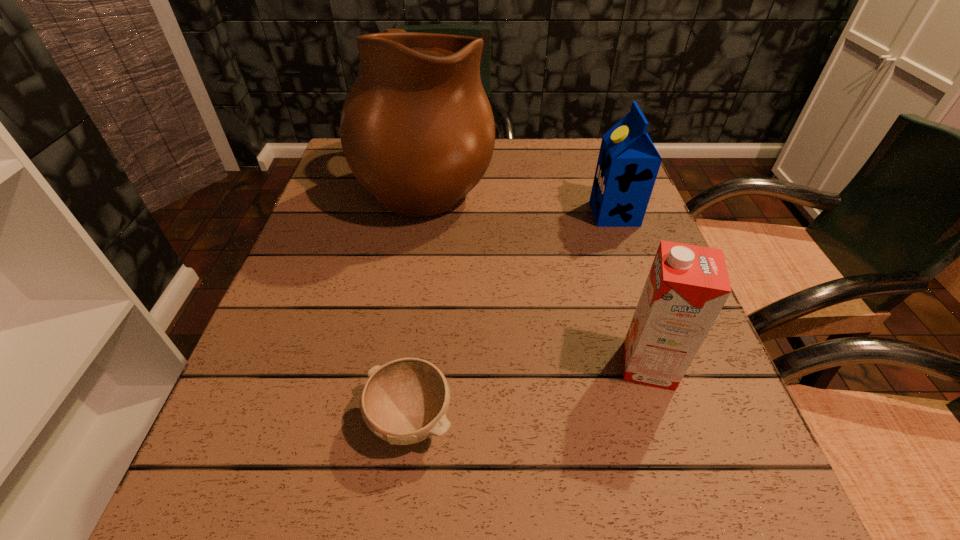
Image resolution: width=960 pixels, height=540 pixels. In order to click on object that is at the far edge in this screenshot , I will do `click(417, 130)`.

The width and height of the screenshot is (960, 540). In order to click on object present at the left edge in this screenshot , I will do `click(417, 130)`.

Find the location of a particular element. This screenshot has width=960, height=540. object that is at the far left corner is located at coordinates coord(417,130).

The image size is (960, 540). In the image, there is a desktop. Identify the location of vacant area at the far edge. (560, 167).

The width and height of the screenshot is (960, 540). What are the coordinates of `blank space at the near edge of the desktop` in the screenshot? It's located at (366, 483).

You are a GUI agent. You are given a task and a screenshot of the screen. Output one action in this format:
    pyautogui.click(x=<x>, y=<y>)
    Task: Click on the vacant space at the left edge of the desktop
    The height and width of the screenshot is (540, 960).
    Given the screenshot: What is the action you would take?
    pyautogui.click(x=309, y=446)

Where is `free space at the right edge`? The image size is (960, 540). free space at the right edge is located at coordinates (635, 287).

In the image, there is a desktop. Where is `free space at the near right corner`? The image size is (960, 540). free space at the near right corner is located at coordinates (712, 525).

Where is `free space between the farther carton and the shortest object`? free space between the farther carton and the shortest object is located at coordinates (513, 316).

At what (x,y) coordinates should I click in order to perform the action: click on free point between the nearer carton and the farther carton. Please return your answer as a coordinate pair (x, y). Looking at the image, I should click on (x=632, y=289).